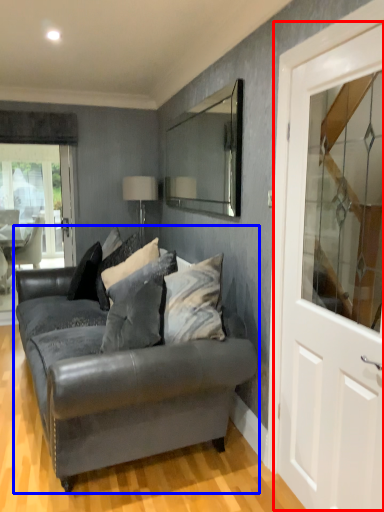
Question: Which of the following is the closest to the observer, door (highlighted by a red box) or studio couch (highlighted by a blue box)?

Choices:
 (A) door
 (B) studio couch

Answer: (A)